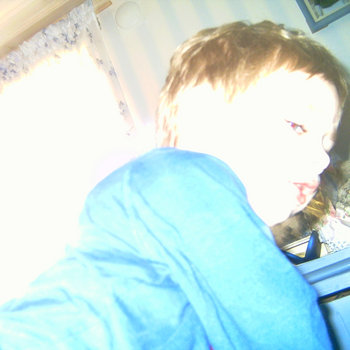
The image size is (350, 350). Identify the location of blue and white striped wall paper. (165, 42).